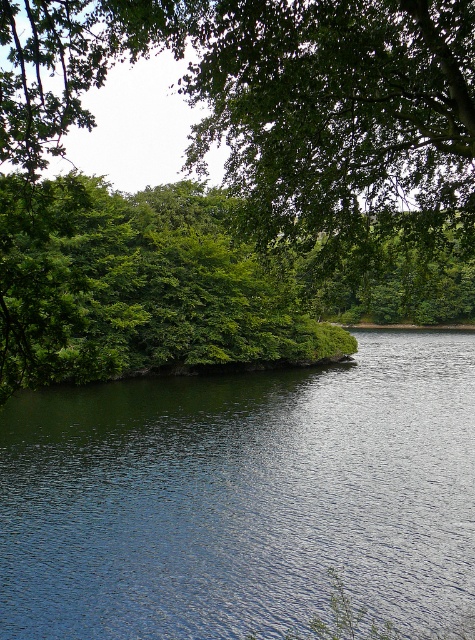
Is green leafy tree at upper center shorter than dark blue water at center?

No.

Is point (278, 120) positioned behind point (167, 448)?

No, (278, 120) is in front of (167, 448).

Identify the location of green leafy tree at upper center. (237, 182).

The width and height of the screenshot is (475, 640). I want to click on green leafy tree at upper center, so click(x=237, y=182).